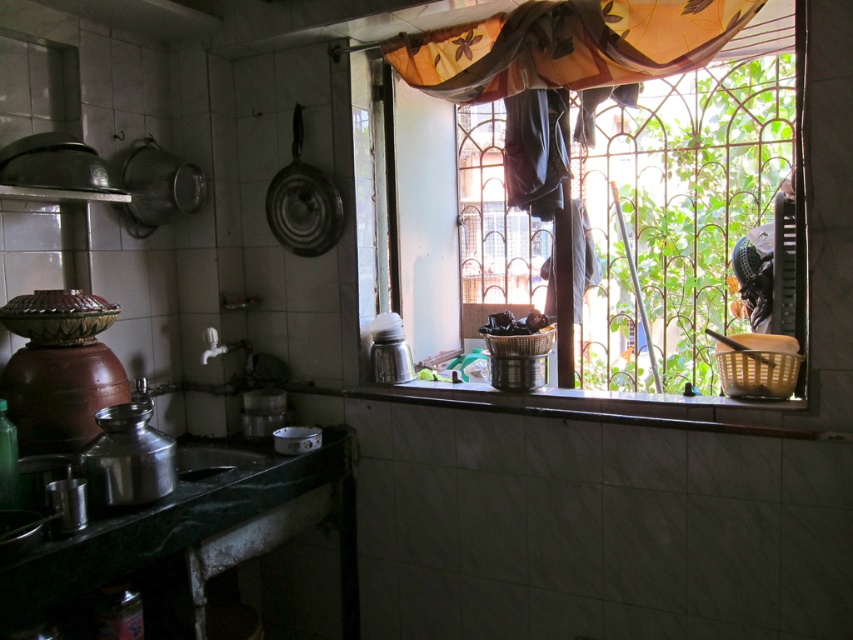
Question: Does translucent fabric at upper right appear on the right side of translucent floral-patterned curtain at upper center?

Choices:
 (A) no
 (B) yes

Answer: (B)

Question: Does translucent floral-patterned curtain at upper center come in front of metallic sink at lower left?

Choices:
 (A) no
 (B) yes

Answer: (B)

Question: Which object is closer to the camera taking this photo?

Choices:
 (A) metallic sink at lower left
 (B) translucent floral-patterned curtain at upper center

Answer: (B)

Question: Which of these objects is positioned farthest from the translucent fabric at upper right?

Choices:
 (A) metallic sink at lower left
 (B) translucent floral-patterned curtain at upper center

Answer: (A)

Question: Which point appears closest to the camera in this image?

Choices:
 (A) (264, 460)
 (B) (637, 209)
 (C) (630, 33)

Answer: (C)

Question: Does translucent floral-patterned curtain at upper center have a larger size compared to metallic sink at lower left?

Choices:
 (A) yes
 (B) no

Answer: (A)